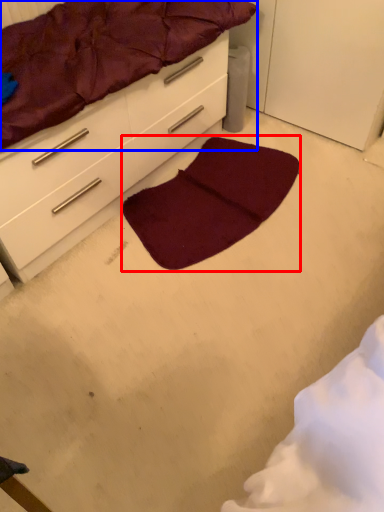
Question: Among these objects, which one is farthest to the camera, mat (highlighted by a red box) or mattress (highlighted by a blue box)?

Choices:
 (A) mat
 (B) mattress

Answer: (A)